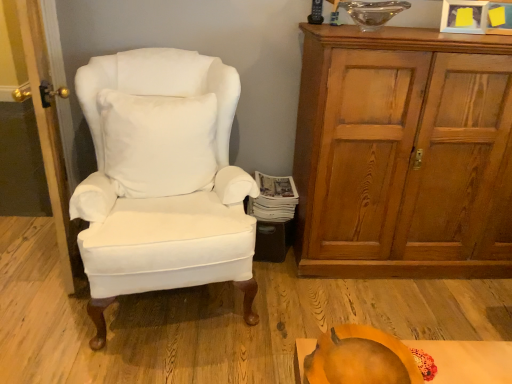
This screenshot has width=512, height=384. I want to click on free spot in front of wooden door at left, so click(37, 301).